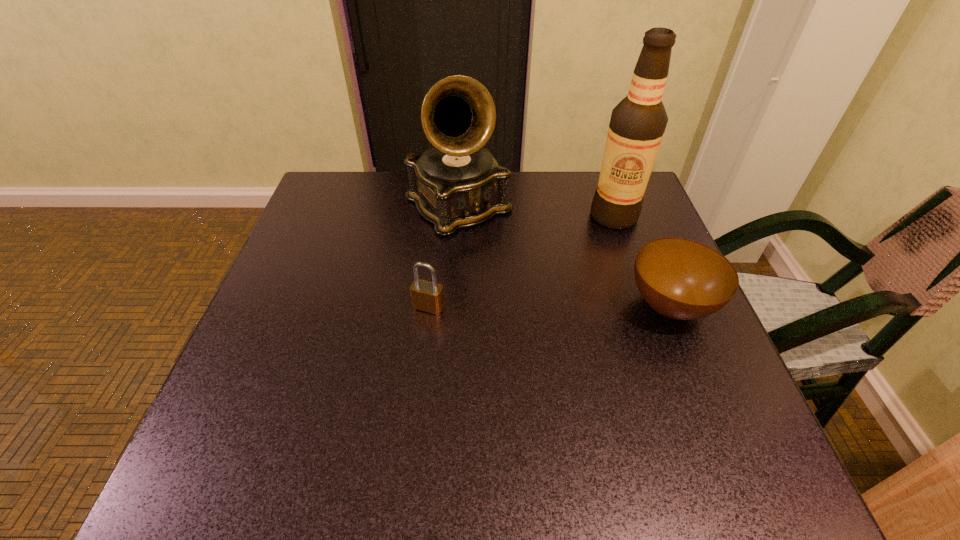
Locate an element on the screen. This screenshot has width=960, height=540. free spot located 0.100m on the label of the alcohol is located at coordinates (580, 247).

The width and height of the screenshot is (960, 540). Identify the location of vacant position located 0.400m on the label of the alcohol. (500, 321).

The height and width of the screenshot is (540, 960). I want to click on phonograph record positioned at the far edge, so click(x=457, y=183).

Locate an element on the screen. This screenshot has height=540, width=960. alcohol situated at the far edge is located at coordinates (637, 125).

Image resolution: width=960 pixels, height=540 pixels. I want to click on bowl that is positioned at the right edge, so click(x=682, y=279).

The height and width of the screenshot is (540, 960). What are the coordinates of `alcohol present at the right edge` in the screenshot? It's located at (637, 125).

This screenshot has width=960, height=540. I want to click on object that is at the far right corner, so click(637, 125).

At what (x,y) coordinates should I click in order to perform the action: click on free region at the far edge of the desktop. Please return your answer as a coordinate pair (x, y). This screenshot has height=540, width=960. Looking at the image, I should click on (573, 215).

Locate an element on the screen. free space at the near edge is located at coordinates (435, 411).

At what (x,y) coordinates should I click in order to perform the action: click on vacant space at the left edge of the desktop. Please return your answer as a coordinate pair (x, y). Image resolution: width=960 pixels, height=540 pixels. Looking at the image, I should click on (321, 279).